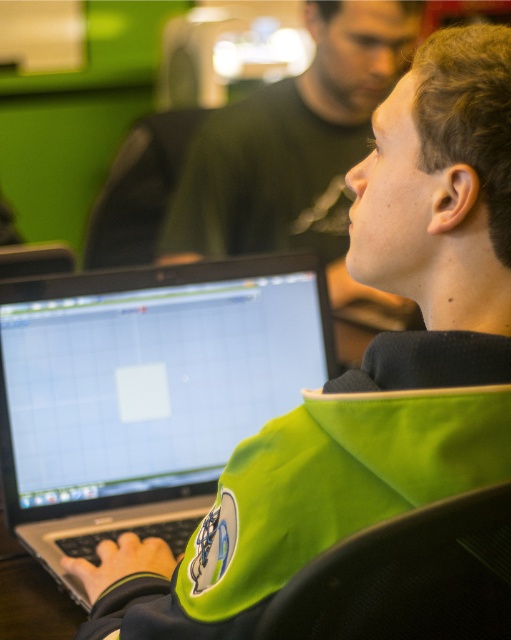
Where is `silver metallic laptop at center`? This screenshot has width=511, height=640. silver metallic laptop at center is located at coordinates (146, 392).

Which is above, silver metallic laptop at center or green matte jacket at upper center?

Positioned higher is green matte jacket at upper center.

Is point (181, 465) more distant than point (290, 148)?

No, it is in front of (290, 148).

Locate an element on the screen. silver metallic laptop at center is located at coordinates (146, 392).